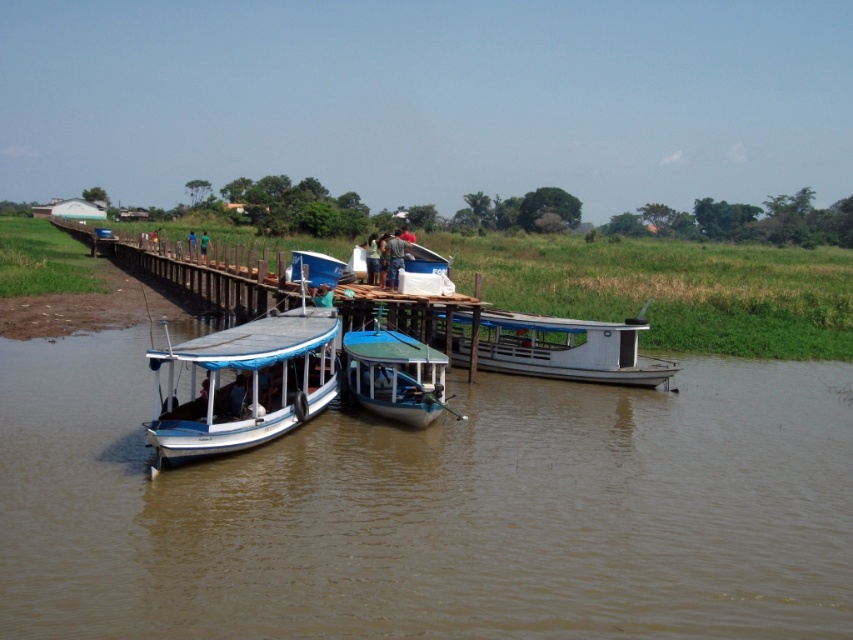
You are standing at the riverside and want to know how far the point at coordinates (84, 241) is from where you are standing. Can you determine the distance?

The point at coordinates (84, 241) is 282.97 feet away from your current position.

Based on the photo, you are standing at the center of the wooden pier and want to board the blue painted wood boat at lower left. Which direction should you walk to reach it?

You should walk towards the lower left direction to reach the blue painted wood boat at lower left since it is located at point (x=242, y=385) which is in the lower left area of the scene.